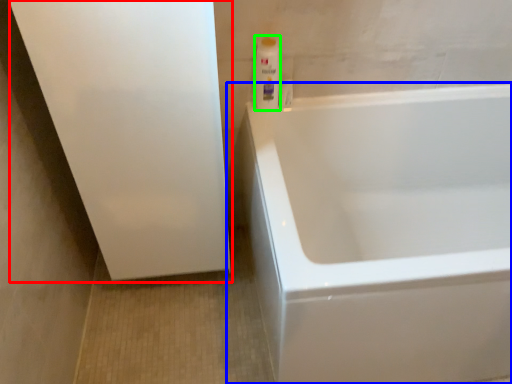
Question: Estimate the real-world distances between objects in this image. Which object is closer to screen door (highlighted by a red box), bathtub (highlighted by a blue box) or cleaning product (highlighted by a green box)?

Choices:
 (A) bathtub
 (B) cleaning product

Answer: (B)